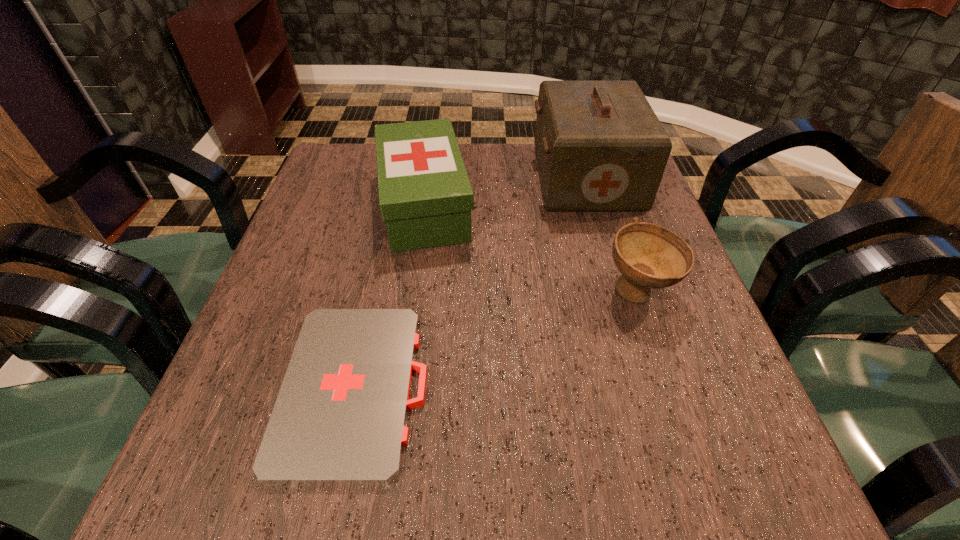
Find the location of a particular element. The width and height of the screenshot is (960, 540). empty space that is in between the tallest first-aid kit and the shortest object is located at coordinates (470, 282).

Locate an element on the screen. The image size is (960, 540). free space between the second shortest first-aid kit and the tallest object is located at coordinates (505, 191).

This screenshot has height=540, width=960. What are the coordinates of `object that ranks as the closest to the soup bowl` in the screenshot? It's located at coord(600,146).

Identify which object is the second closest to the second tallest first-aid kit. Please provide its 2D coordinates. Your answer should be formatted as a tuple, i.e. [(x, y)], where the tuple contains the x and y coordinates of a point satisfying the conditions above.

[(340, 416)]

Identify which first-aid kit is the closest to the second tallest first-aid kit. Please provide its 2D coordinates. Your answer should be formatted as a tuple, i.e. [(x, y)], where the tuple contains the x and y coordinates of a point satisfying the conditions above.

[(600, 146)]

Locate an element on the screen. Image resolution: width=960 pixels, height=540 pixels. the first-aid kit identified as the closest to the shortest object is located at coordinates (425, 197).

Where is `vacant space that satisfies the following two spatial constraints: 1. on the front side of the soup bowl; 2. on the left side of the rightmost first-aid kit`? The width and height of the screenshot is (960, 540). vacant space that satisfies the following two spatial constraints: 1. on the front side of the soup bowl; 2. on the left side of the rightmost first-aid kit is located at coordinates (619, 292).

What are the coordinates of `vacant area that satisfies the following two spatial constraints: 1. on the back side of the second shortest first-aid kit; 2. on the left side of the tallest first-aid kit` in the screenshot? It's located at (428, 177).

The image size is (960, 540). I want to click on vacant space that satisfies the following two spatial constraints: 1. on the back side of the tallest first-aid kit; 2. on the right side of the second tallest first-aid kit, so click(x=428, y=177).

Find the location of a particular element. The width and height of the screenshot is (960, 540). free spot that satisfies the following two spatial constraints: 1. on the front side of the tallest object; 2. on handle side the shortest object is located at coordinates [x=648, y=388].